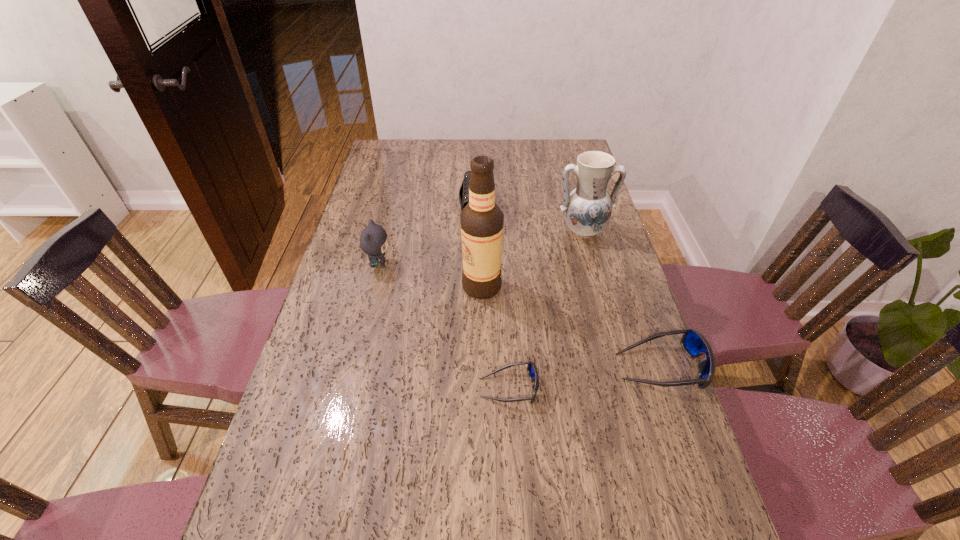
Where is `free region located on either side of the pottery`? free region located on either side of the pottery is located at coordinates (589, 255).

This screenshot has width=960, height=540. In order to click on free space located 0.220m on the label of the alcohol in this screenshot , I will do 388,287.

Find the location of a particular element. This screenshot has width=960, height=540. free location located 0.370m on the label of the alcohol is located at coordinates coord(338,287).

This screenshot has width=960, height=540. In order to click on blank space located 0.370m on the label of the alcohol in this screenshot , I will do `click(338, 287)`.

You are a GUI agent. You are given a task and a screenshot of the screen. Output one action in this format:
    pyautogui.click(x=<x>, y=<y>)
    Task: Click on the free location located 0.190m on the front-facing side of the leftmost object
    This screenshot has height=540, width=960.
    Given the screenshot: What is the action you would take?
    pyautogui.click(x=453, y=265)

At what (x,y) coordinates should I click in order to perform the action: click on blank space located on the front flap of the clutch bag. Please return your answer as a coordinate pair (x, y). Image resolution: width=960 pixels, height=540 pixels. Looking at the image, I should click on (506, 214).

Image resolution: width=960 pixels, height=540 pixels. In order to click on object situated at the left edge in this screenshot , I will do `click(373, 240)`.

Locate an element on the screen. Image resolution: width=960 pixels, height=540 pixels. sunglasses that is at the right edge is located at coordinates (693, 342).

Image resolution: width=960 pixels, height=540 pixels. I want to click on pottery that is at the right edge, so (587, 209).

The width and height of the screenshot is (960, 540). Identify the location of free space at the far edge of the desktop. (512, 157).